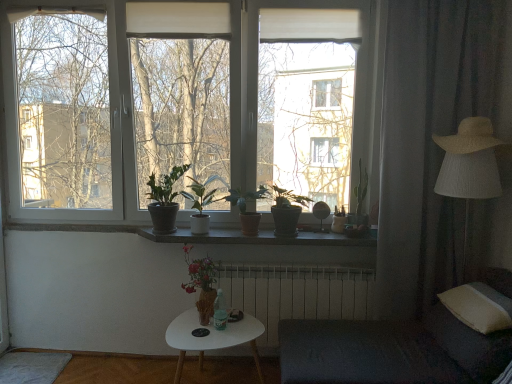
Locate an element on the screen. gray fabric curtain at right is located at coordinates (439, 147).

What is the approximate height of gray fabric curtain at right?

It is 6.79 feet.

The image size is (512, 384). What do you see at coordinates (359, 199) in the screenshot?
I see `green matte cactus at upper right` at bounding box center [359, 199].

Image resolution: width=512 pixels, height=384 pixels. What do you see at coordinates (259, 238) in the screenshot?
I see `brown matte window sill at center` at bounding box center [259, 238].

Locate an element on the screen. green matte plant at center, marked as the 4th houseplant in a right-to-left arrangement is located at coordinates (201, 203).

This screenshot has width=512, height=384. What do you see at coordinates (391, 351) in the screenshot?
I see `dark gray fabric armchair at lower right` at bounding box center [391, 351].

Where is `green matte plant at center, the 2th houseplant in the right-to-left sequence`? This screenshot has width=512, height=384. green matte plant at center, the 2th houseplant in the right-to-left sequence is located at coordinates 246,208.

From the picture: Does dark gray fabric armchair at lower right have a smaller size compared to gray fabric curtain at right?

Incorrect, dark gray fabric armchair at lower right is not smaller in size than gray fabric curtain at right.

Is gray fabric curtain at right a part of dark gray fabric armchair at lower right?

Definitely not — gray fabric curtain at right is not inside dark gray fabric armchair at lower right.

From the image's perspective, which one is positioned higher, dark gray fabric armchair at lower right or gray fabric curtain at right?

gray fabric curtain at right appears higher in the image.

Locate an element on the screen. curtain located behind the dark gray fabric armchair at lower right is located at coordinates (439, 147).

At what (x,y) coordinates should I click in order to perform the action: click on the 4th houseplant in front when counting from the green matte cactus at upper right. Please return your answer as a coordinate pair (x, y). This screenshot has height=384, width=512. Looking at the image, I should click on (246, 208).

Consider the image. Is green matte plant at center, marked as the 4th houseplant in a left-to-right arrangement, taller or shorter than green matte cactus at upper right?

green matte plant at center, marked as the 4th houseplant in a left-to-right arrangement, is shorter than green matte cactus at upper right.

Is green matte plant at center, marked as the 4th houseplant in a left-to-right arrangement, at the left side of green matte cactus at upper right?

Correct, you'll find green matte plant at center, marked as the 4th houseplant in a left-to-right arrangement, to the left of green matte cactus at upper right.

Based on the photo, is green matte plant at center, marked as the 4th houseplant in a left-to-right arrangement, thinner than green matte cactus at upper right?

In fact, green matte plant at center, marked as the 4th houseplant in a left-to-right arrangement, might be wider than green matte cactus at upper right.

Considering the relative sizes of matte brown vase at center, which appears as the 3th houseplant when viewed from the right, and green matte cactus at upper right in the image provided, is matte brown vase at center, which appears as the 3th houseplant when viewed from the right, shorter than green matte cactus at upper right?

Correct, matte brown vase at center, which appears as the 3th houseplant when viewed from the right, is not as tall as green matte cactus at upper right.

In terms of width, does matte brown vase at center, which appears as the 3th houseplant when viewed from the right, look wider or thinner when compared to green matte cactus at upper right?

matte brown vase at center, which appears as the 3th houseplant when viewed from the right, is wider than green matte cactus at upper right.

Is matte brown vase at center, the third houseplant viewed from the left, next to green matte cactus at upper right?

No.

Is dark gray fabric armchair at lower right oriented away from white soft pillow at lower right?

Yes, dark gray fabric armchair at lower right's orientation is away from white soft pillow at lower right.

Which point is more forward, (497, 343) or (470, 294)?

The point (497, 343) is in front.

Measure the distance between dark gray fabric armchair at lower right and white soft pillow at lower right.

12.43 inches.

From a real-world perspective, is dark gray fabric armchair at lower right located higher than white soft pillow at lower right?

No, from a real-world perspective, dark gray fabric armchair at lower right is not over white soft pillow at lower right

In the scene shown: Considering the relative positions of brown matte window sill at center and matte brown vase at center, the third houseplant viewed from the left, in the image provided, is brown matte window sill at center to the left of matte brown vase at center, the third houseplant viewed from the left, from the viewer's perspective?

No.

From the image's perspective, does brown matte window sill at center appear higher than matte brown vase at center, the third houseplant viewed from the left?

Yes.

Can we say brown matte window sill at center lies outside matte brown vase at center, the third houseplant viewed from the left?

brown matte window sill at center lies outside matte brown vase at center, the third houseplant viewed from the left,'s area.

Is brown matte window sill at center oriented away from matte brown vase at center, which appears as the 3th houseplant when viewed from the right?

No.

Between brown matte window sill at center and dark gray fabric armchair at lower right, which one has larger size?

With larger size is dark gray fabric armchair at lower right.

Is point (294, 242) less distant than point (384, 375)?

No, it is not.

Visually, is brown matte window sill at center positioned to the left or to the right of dark gray fabric armchair at lower right?

brown matte window sill at center is positioned on dark gray fabric armchair at lower right's left side.

Is brown matte window sill at center next to dark gray fabric armchair at lower right?

No, brown matte window sill at center is not with dark gray fabric armchair at lower right.

Can you confirm if dark gray fabric armchair at lower right is wider than white metallic radiator at center?

Indeed, dark gray fabric armchair at lower right has a greater width compared to white metallic radiator at center.

How distant is dark gray fabric armchair at lower right from white metallic radiator at center?

They are 16.63 inches apart.

Is dark gray fabric armchair at lower right positioned far away from white metallic radiator at center?

They are positioned close to each other.

What are the coordinates of `armchair below the gray fabric curtain at right (from the image's perspective)` in the screenshot? It's located at (391, 351).

Find the location of a particular element. This screenshot has width=512, height=384. the 4th houseplant in front of the green matte cactus at upper right is located at coordinates (246, 208).

From the image, which object appears to be nearer to green matte plant at center, marked as the 1th houseplant in a right-to-left arrangement, white metallic radiator at center or strawmaterial/texturehat at right?

white metallic radiator at center is positioned closer to the anchor green matte plant at center, marked as the 1th houseplant in a right-to-left arrangement.

From the image, which object appears to be farther from green matte plant at center, the 2th houseplant in the right-to-left sequence, gray fabric curtain at right or brown matte window sill at center?

gray fabric curtain at right.

From the image, which object appears to be nearer to brown matte window sill at center, green matte plant at center, the 2th houseplant in the right-to-left sequence, or white metallic radiator at center?

Among the two, green matte plant at center, the 2th houseplant in the right-to-left sequence, is located nearer to brown matte window sill at center.

Estimate the real-world distances between objects in this image. Which object is further from white matte coffee table at lower center, green matte plant at center, the fifth houseplant in the left-to-right sequence, or green matte plant at center, acting as the 1th houseplant starting from the left?

green matte plant at center, acting as the 1th houseplant starting from the left, lies further to white matte coffee table at lower center than the other object.

Considering their positions, is brown matte window sill at center positioned further to green matte plant at center, the fifth houseplant in the left-to-right sequence, than white metallic radiator at center?

white metallic radiator at center is further to green matte plant at center, the fifth houseplant in the left-to-right sequence.

Which object lies nearer to the anchor point white metallic radiator at center, matte brown vase at center, the third houseplant viewed from the left, or green matte plant at center, marked as the 4th houseplant in a right-to-left arrangement?

matte brown vase at center, the third houseplant viewed from the left, lies closer to white metallic radiator at center than the other object.

Estimate the real-world distances between objects in this image. Which object is further from green matte plant at center, which ranks as the fifth houseplant in right-to-left order, brown matte window sill at center or matte brown vase at center, the third houseplant viewed from the left?

Based on the image, matte brown vase at center, the third houseplant viewed from the left, appears to be further to green matte plant at center, which ranks as the fifth houseplant in right-to-left order.

Which object lies nearer to the anchor point green matte plant at center, marked as the 4th houseplant in a right-to-left arrangement, dark gray fabric armchair at lower right or green matte plant at center, the fifth houseplant in the left-to-right sequence?

The object closer to green matte plant at center, marked as the 4th houseplant in a right-to-left arrangement, is green matte plant at center, the fifth houseplant in the left-to-right sequence.

Where is `plant between matte brown vase at center, which appears as the 3th houseplant when viewed from the right, and strawmaterial/texturehat at right, in the horizontal direction`? plant between matte brown vase at center, which appears as the 3th houseplant when viewed from the right, and strawmaterial/texturehat at right, in the horizontal direction is located at coordinates (359, 199).

Find the location of a particular element. curtain between white matte coffee table at lower center and white soft pillow at lower right is located at coordinates (439, 147).

This screenshot has width=512, height=384. Identify the location of houseplant between brown matte window sill at center and strawmaterial/texturehat at right from left to right. (285, 209).

This screenshot has width=512, height=384. Identify the location of armchair located between white matte coffee table at lower center and gray fabric curtain at right in the left-right direction. (391, 351).